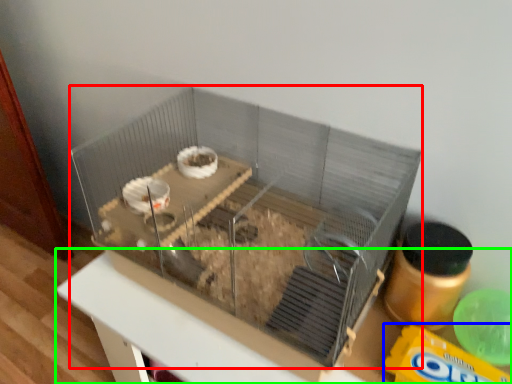
Question: Estimate the real-world distances between objects in this image. Which object is closer to glass box (highlighted by a red box), cereal (highlighted by a blue box) or table (highlighted by a green box)?

Choices:
 (A) cereal
 (B) table

Answer: (B)